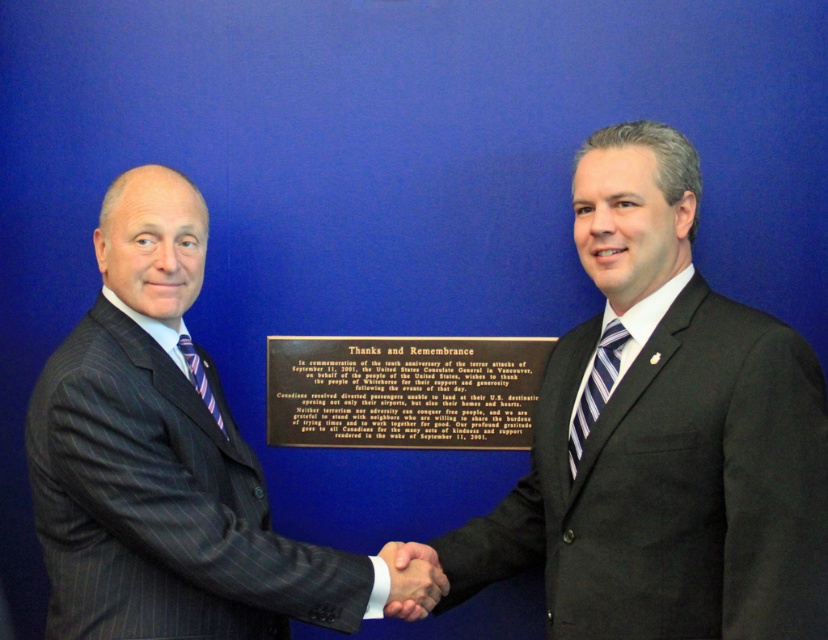
You are a photographer setting up for a formal event. You need to ensure that the dark gray pinstripe suit at center and the striped fabric tie at left are both visible in your photo. Based on their positions, which object is closer to the camera?

The dark gray pinstripe suit at center is closer to the camera because it is in front of the striped fabric tie at left.

Two men in dark suits are shaking hands in front of a blue wall with a plaque. The man on the left is bald, and the man on the right has short gray hair. They are standing at point [227,428]. How far apart are they?

The two men are 5.84 feet apart.

Based on the coordinates provided, where is the dark gray pinstripe suit at center located in the image?

The dark gray pinstripe suit at center is located at coordinates point (162,460).